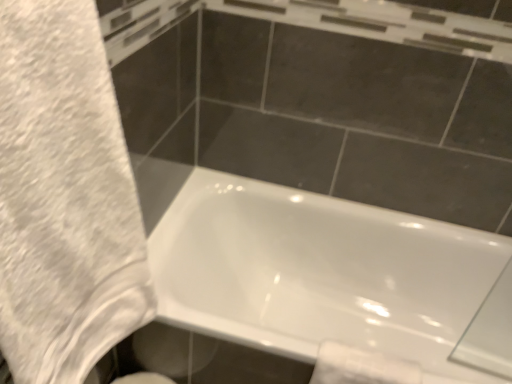
Question: Is white glossy toilet paper at lower right inside or outside of white glossy bathtub at lower center?

Choices:
 (A) inside
 (B) outside

Answer: (A)

Question: Is white glossy toilet paper at lower right in front of or behind white glossy bathtub at lower center in the image?

Choices:
 (A) behind
 (B) front

Answer: (A)

Question: Estimate the real-world distances between objects in this image. Which object is closer to the white glossy bathtub at lower center?

Choices:
 (A) white glossy toilet paper at lower right
 (B) white fluffy towel at left

Answer: (A)

Question: Estimate the real-world distances between objects in this image. Which object is closer to the white fluffy towel at left?

Choices:
 (A) white glossy toilet paper at lower right
 (B) white glossy bathtub at lower center

Answer: (A)